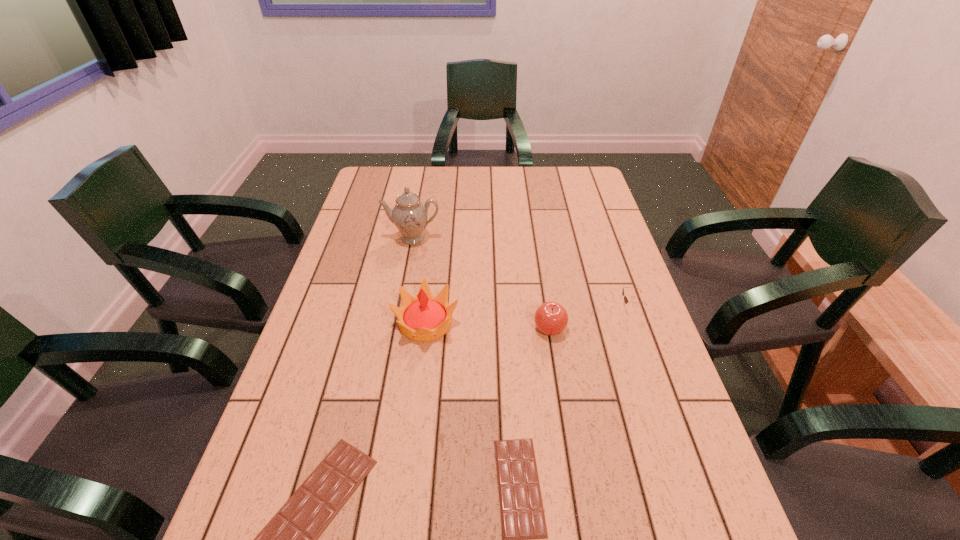
Find the location of a particular element. This screenshot has height=540, width=960. vacant area at the far right corner of the desktop is located at coordinates (576, 167).

This screenshot has width=960, height=540. What are the coordinates of `vacant space that is in between the fourth tallest object and the apple` in the screenshot? It's located at (590, 318).

Identify the location of free space between the farthest object and the fourth tallest object. This screenshot has width=960, height=540. (521, 273).

Identify the location of free spot between the chinaware and the fourth tallest object. The height and width of the screenshot is (540, 960). (521, 273).

You are a GUI agent. You are given a task and a screenshot of the screen. Output one action in this format:
    pyautogui.click(x=<x>, y=<y>)
    Task: Click on the vacant area that lies between the fifth object from left to right and the tallest object
    Image resolution: width=960 pixels, height=540 pixels.
    Given the screenshot: What is the action you would take?
    pyautogui.click(x=481, y=284)

Find the location of a particular element. Image resolution: width=960 pixels, height=540 pixels. vacant point located between the second tallest object and the fourth tallest object is located at coordinates (528, 315).

You are a GUI agent. You are given a task and a screenshot of the screen. Output one action in this format:
    pyautogui.click(x=<x>, y=<y>)
    Task: Click on the third closest object to the rightmost object
    
    Given the screenshot: What is the action you would take?
    pyautogui.click(x=425, y=318)

Identify the location of object that is the fifth closest to the third tallest object. The width and height of the screenshot is (960, 540). (289, 539).

Where is `free location that satisfies the following two spatial constraints: 1. on the spout of the crown; 2. on the left side of the chinaware`? The height and width of the screenshot is (540, 960). free location that satisfies the following two spatial constraints: 1. on the spout of the crown; 2. on the left side of the chinaware is located at coordinates (396, 323).

I want to click on free space that satisfies the following two spatial constraints: 1. on the spout of the farthest object; 2. on the right side of the fifth shortest object, so click(396, 323).